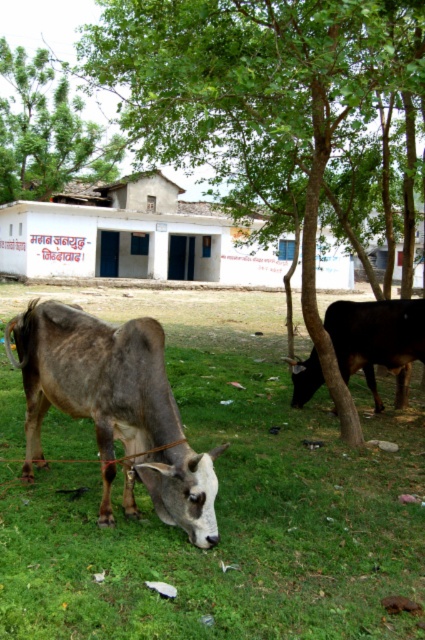
Can you confirm if green leafy tree at center is positioned to the left of green leafy tree at upper left?

Incorrect, green leafy tree at center is not on the left side of green leafy tree at upper left.

Does green leafy tree at center appear on the right side of green leafy tree at upper left?

Correct, you'll find green leafy tree at center to the right of green leafy tree at upper left.

This screenshot has height=640, width=425. I want to click on green leafy tree at center, so click(246, 106).

Who is shorter, green grass at lower center or green leafy tree at upper left?

With less height is green grass at lower center.

Can you confirm if green grass at lower center is shorter than green leafy tree at upper left?

Yes, green grass at lower center is shorter than green leafy tree at upper left.

Does point (163, 621) lie in front of point (3, 140)?

Yes, point (163, 621) is closer to viewer.

Identify the location of green grass at lower center. The image size is (425, 640). (227, 506).

Which is behind, point (295, 99) or point (39, 349)?

Point (295, 99)

The height and width of the screenshot is (640, 425). What do you see at coordinates (246, 106) in the screenshot? I see `green leafy tree at center` at bounding box center [246, 106].

The image size is (425, 640). What are the coordinates of `green leafy tree at center` in the screenshot? It's located at (246, 106).

You are a GUI agent. You are given a task and a screenshot of the screen. Output one action in this format:
    pyautogui.click(x=<x>, y=<y>)
    Task: Click on the green leafy tree at center
    The width and height of the screenshot is (425, 640).
    Given the screenshot: What is the action you would take?
    pyautogui.click(x=246, y=106)